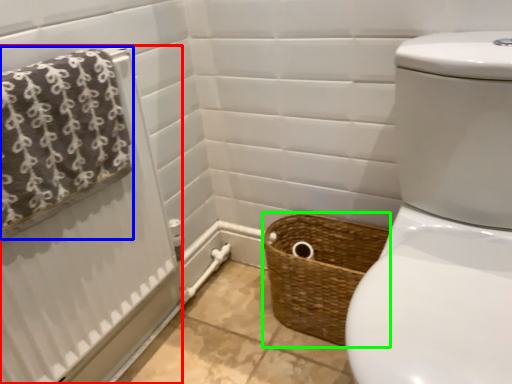
Question: Which object is the closest to the shower curtain (highlighted by a red box)? Choose among these: bath towel (highlighted by a blue box) or basket (highlighted by a green box).

Choices:
 (A) bath towel
 (B) basket

Answer: (A)